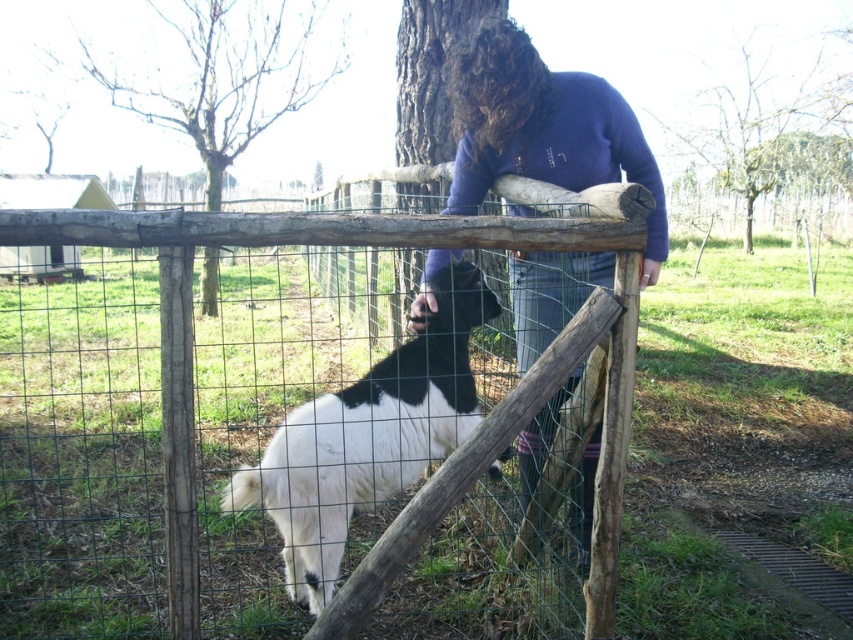
You are a photographer trying to capture a closeup of the black and white fur at center without the purple fleece sweater at center blocking the view. Can you adjust your position to do so?

The purple fleece sweater at center is in front of the black and white fur at center, so moving your position to the side or behind the purple fleece sweater at center would allow you to capture the black and white fur at center without obstruction.

You are standing at the center of the image and want to reach the purple fleece sweater at center without crossing the wooden fence at center. Is it possible?

The wooden fence at center is 5.74 feet away from purple fleece sweater at center, so you can reach the purple fleece sweater at center without crossing the wooden fence at center as they are both at the center and the distance between them is manageable.

You are standing in the rural outdoor scene and see the purple fleece sweater at center and the black and white fur at center. Which object is closer to your right side?

The purple fleece sweater at center is to the right of black and white fur at center, so the purple fleece sweater at center is closer to your right side.